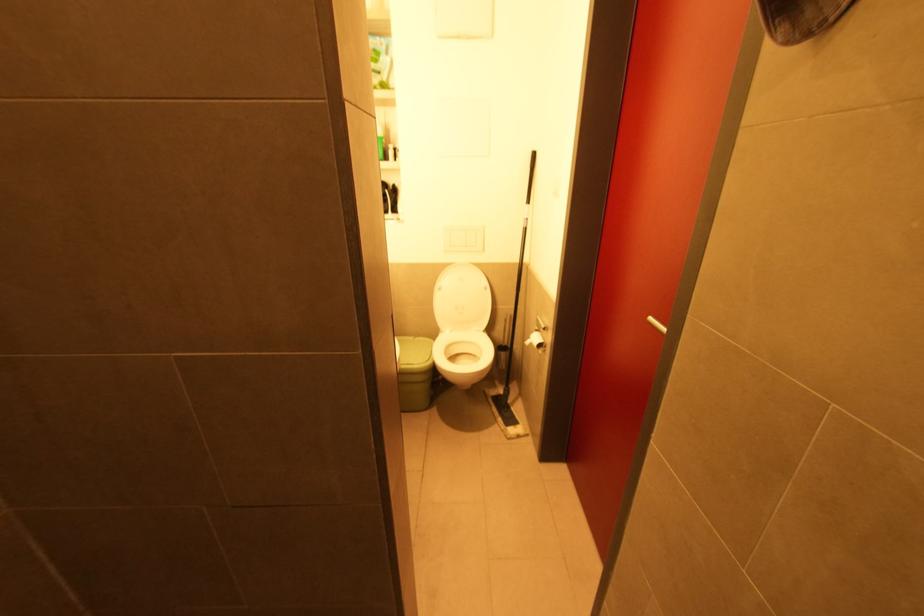
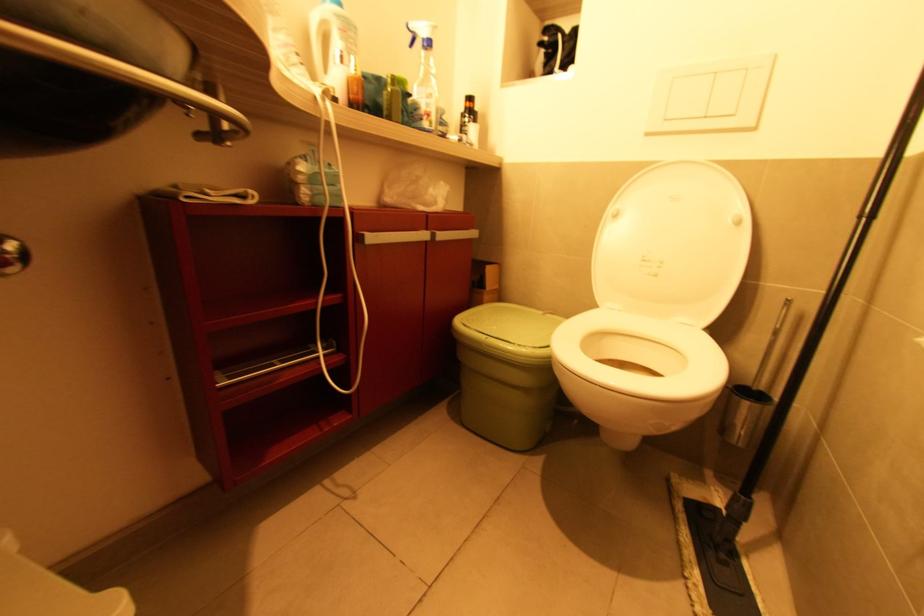
Where in the second image is the point corresponding to pixel 417 339 from the first image?

(545, 314)